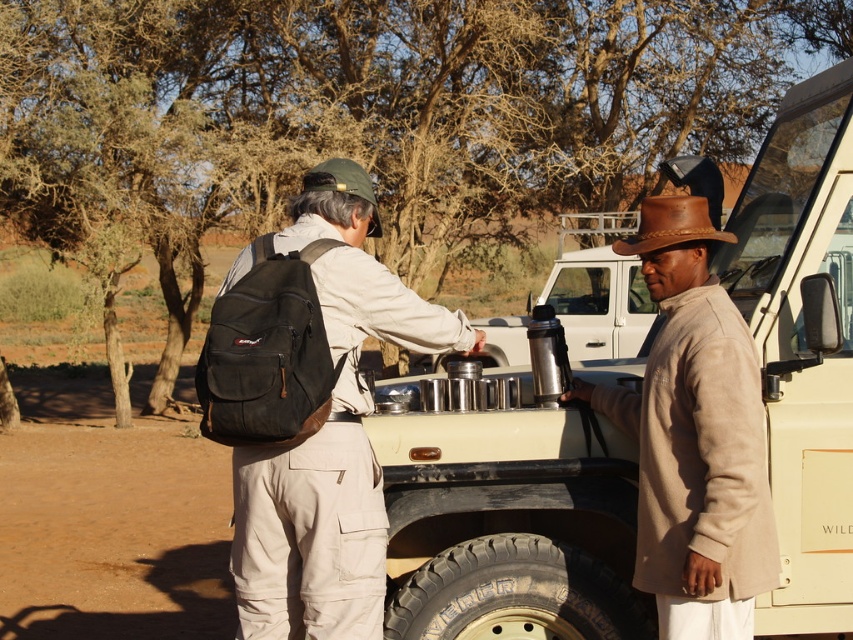
You are a photographer trying to capture both the matte black backpack at center and the brown leather cowboy hat at right in a single frame. Based on their positions, can you determine which object is closer to the camera?

The matte black backpack at center is positioned under the brown leather cowboy hat at right, which means the backpack is closer to the camera than the hat.

You are a photographer standing at the back of the metallic beige jeep at center. You want to take a photo of the tan suede hat at right. Can you reach the hat without moving from your current position?

The metallic beige jeep at center is 21.91 inches away from the tan suede hat at right, so you can reach the hat without moving from your current position as the distance is within arm reach.

From the picture: You are planning to take a photo of the metallic beige jeep at center from a specific angle. Given that the jeep is positioned at coordinates point 0.819, 0.597, which direction should you move relative to the jeep to ensure it fits perfectly in your camera frame?

The metallic beige jeep at center is located at point (508, 524), so moving towards the lower right direction would position the jeep centrally within the camera frame.